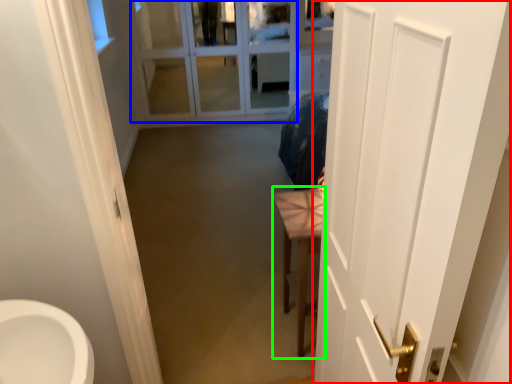
Question: Considering the real-world distances, which object is farthest from door (highlighted by a red box)? glass door (highlighted by a blue box) or furniture (highlighted by a green box)?

Choices:
 (A) glass door
 (B) furniture

Answer: (A)